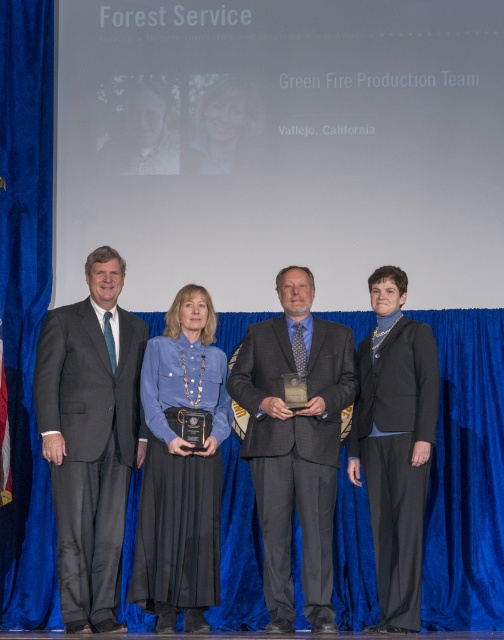
Question: Can you confirm if dark gray suit at center is wider than gray wool suit at center?

Choices:
 (A) no
 (B) yes

Answer: (A)

Question: In this image, where is gray wool suit at center located relative to blue satin blouse at center?

Choices:
 (A) right
 (B) left

Answer: (A)

Question: Can you confirm if blue satin blouse at center is bigger than matte black hair at center?

Choices:
 (A) yes
 (B) no

Answer: (A)

Question: Which of the following is the closest to the observer?

Choices:
 (A) (305, 444)
 (B) (144, 372)

Answer: (A)

Question: Which point is farther to the camera?

Choices:
 (A) blue satin blouse at center
 (B) gray wool suit at center
 (C) dark gray suit at center
 (D) matte black hair at center

Answer: (D)

Question: Which point appears closest to the camera in this image?

Choices:
 (A) (235, 136)
 (B) (117, 515)
 (C) (263, 488)
 (D) (139, 602)

Answer: (D)